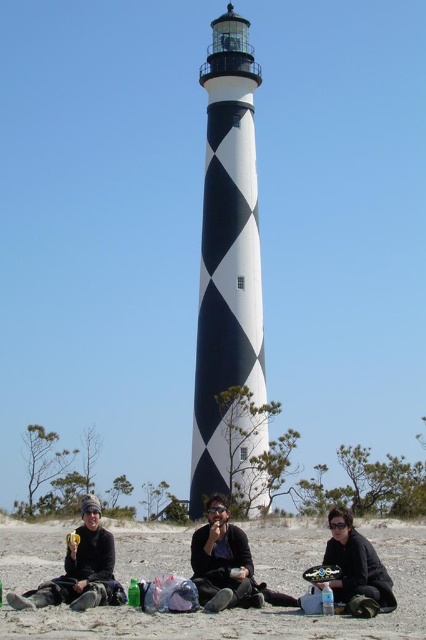
Who is positioned more to the left, matte black sunglasses at center or black matte jacket at lower center?

Positioned to the left is matte black sunglasses at center.

Identify the location of matte black sunglasses at center. (222, 561).

Is point (134, 616) closer to viewer compared to point (259, 595)?

Yes, point (134, 616) is in front of point (259, 595).

Between point (273, 636) and point (198, 541), which one is positioned in front?

Positioned in front is point (273, 636).

At what (x,y) coordinates should I click in order to perform the action: click on black sand at lower center. Please return your answer as a coordinate pair (x, y). The height and width of the screenshot is (640, 426). Looking at the image, I should click on (201, 611).

Which is more to the left, matte black jacket at lower left or black matte jacket at lower center?

From the viewer's perspective, matte black jacket at lower left appears more on the left side.

Is matte black jacket at lower left closer to camera compared to black matte jacket at lower center?

That is False.

Between point (51, 593) and point (370, 611), which one is positioned in front?

Positioned in front is point (370, 611).

You are a GUI agent. You are given a task and a screenshot of the screen. Output one action in this format:
    pyautogui.click(x=<x>, y=<y>)
    Task: Click on the matte black jacket at lower left
    This screenshot has height=640, width=426.
    Given the screenshot: What is the action you would take?
    pyautogui.click(x=80, y=568)